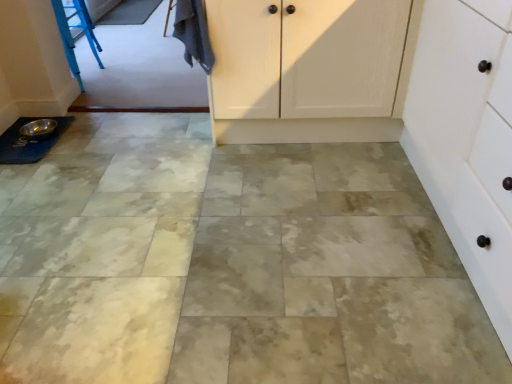
What do you see at coordinates (29, 141) in the screenshot? I see `silver metallic bowl at lower left` at bounding box center [29, 141].

The height and width of the screenshot is (384, 512). What do you see at coordinates (467, 139) in the screenshot?
I see `white matte cabinet at right` at bounding box center [467, 139].

The height and width of the screenshot is (384, 512). Identify the location of silver metallic bowl at lower left. (29, 141).

From a real-world perspective, between dark gray fabric at upper left and white matte cabinet at right, who is vertically lower?

From a 3D spatial view, white matte cabinet at right is below.

In the scene shown: Which object is thinner, dark gray fabric at upper left or white matte cabinet at right?

dark gray fabric at upper left is thinner.

Is dark gray fabric at upper left at the left side of white matte cabinet at right?

Indeed, dark gray fabric at upper left is positioned on the left side of white matte cabinet at right.

From the image's perspective, is dark gray fabric at upper left below white matte cabinet at right?

No.

Is dark gray fabric at upper left turned away from silver metallic bowl at lower left?

dark gray fabric at upper left does not have its back to silver metallic bowl at lower left.

Which is behind, dark gray fabric at upper left or silver metallic bowl at lower left?

silver metallic bowl at lower left is further from the camera.

Is dark gray fabric at upper left located outside silver metallic bowl at lower left?

Yes, dark gray fabric at upper left is outside of silver metallic bowl at lower left.

Consider the image. Is dark gray fabric at upper left not near silver metallic bowl at lower left?

dark gray fabric at upper left is actually quite close to silver metallic bowl at lower left.

Is white matte cabinet at right far away from dark gray fabric at upper left?

Yes, white matte cabinet at right is far from dark gray fabric at upper left.

Is white matte cabinet at right positioned with its back to dark gray fabric at upper left?

No, white matte cabinet at right's orientation is not away from dark gray fabric at upper left.

Considering the sizes of white matte cabinet at right and dark gray fabric at upper left in the image, is white matte cabinet at right wider or thinner than dark gray fabric at upper left?

white matte cabinet at right is wider than dark gray fabric at upper left.

Considering the relative positions of white matte cabinet at right and dark gray fabric at upper left in the image provided, is white matte cabinet at right to the left of dark gray fabric at upper left from the viewer's perspective?

No, white matte cabinet at right is not to the left of dark gray fabric at upper left.

Which of these two, silver metallic bowl at lower left or white matte cabinet at right, is smaller?

silver metallic bowl at lower left is smaller.

Is silver metallic bowl at lower left positioned with its back to white matte cabinet at right?

silver metallic bowl at lower left does not have its back to white matte cabinet at right.

Could white matte cabinet at right be considered to be inside silver metallic bowl at lower left?

No, white matte cabinet at right is not a part of silver metallic bowl at lower left.

In the image, is silver metallic bowl at lower left positioned in front of or behind white matte cabinet at right?

In the image, silver metallic bowl at lower left appears behind white matte cabinet at right.

Locate an element on the screen. sink behind the white matte cabinet at right is located at coordinates (29, 141).

From the picture: Considering the relative sizes of white matte cabinet at right and silver metallic bowl at lower left in the image provided, is white matte cabinet at right bigger than silver metallic bowl at lower left?

Yes, white matte cabinet at right is bigger than silver metallic bowl at lower left.

Considering the positions of points (426, 139) and (58, 133), is point (426, 139) farther from camera compared to point (58, 133)?

That is False.

Considering the sizes of objects silver metallic bowl at lower left and dark gray fabric at upper left in the image provided, who is smaller, silver metallic bowl at lower left or dark gray fabric at upper left?

Smaller between the two is silver metallic bowl at lower left.

Is silver metallic bowl at lower left positioned with its back to dark gray fabric at upper left?

That's not correct — silver metallic bowl at lower left is not looking away from dark gray fabric at upper left.

Would you say silver metallic bowl at lower left is to the left or to the right of dark gray fabric at upper left in the picture?

silver metallic bowl at lower left is positioned on dark gray fabric at upper left's left side.

Is silver metallic bowl at lower left not within dark gray fabric at upper left?

Yes, silver metallic bowl at lower left is located beyond the bounds of dark gray fabric at upper left.

In the image, there is a dark gray fabric at upper left. Identify the location of cabinetry below it (from a real-world perspective). This screenshot has height=384, width=512. (467, 139).

Where is `laundry on the right of the silver metallic bowl at lower left`? This screenshot has height=384, width=512. laundry on the right of the silver metallic bowl at lower left is located at coordinates (194, 33).

Considering their positions, is white matte cabinet at right positioned closer to silver metallic bowl at lower left than dark gray fabric at upper left?

dark gray fabric at upper left.

Based on their spatial positions, is white matte cabinet at right or silver metallic bowl at lower left further from dark gray fabric at upper left?

white matte cabinet at right lies further to dark gray fabric at upper left than the other object.

Considering their positions, is dark gray fabric at upper left positioned closer to silver metallic bowl at lower left than white matte cabinet at right?

Based on the image, dark gray fabric at upper left appears to be nearer to silver metallic bowl at lower left.

Considering their positions, is silver metallic bowl at lower left positioned further to white matte cabinet at right than dark gray fabric at upper left?

Based on the image, silver metallic bowl at lower left appears to be further to white matte cabinet at right.

Based on their spatial positions, is dark gray fabric at upper left or silver metallic bowl at lower left closer to white matte cabinet at right?

dark gray fabric at upper left lies closer to white matte cabinet at right than the other object.

Looking at the image, which one is located further to dark gray fabric at upper left, silver metallic bowl at lower left or white matte cabinet at right?

white matte cabinet at right is further to dark gray fabric at upper left.

At what (x,y) coordinates should I click in order to perform the action: click on laundry situated between silver metallic bowl at lower left and white matte cabinet at right from left to right. Please return your answer as a coordinate pair (x, y). Looking at the image, I should click on (194, 33).